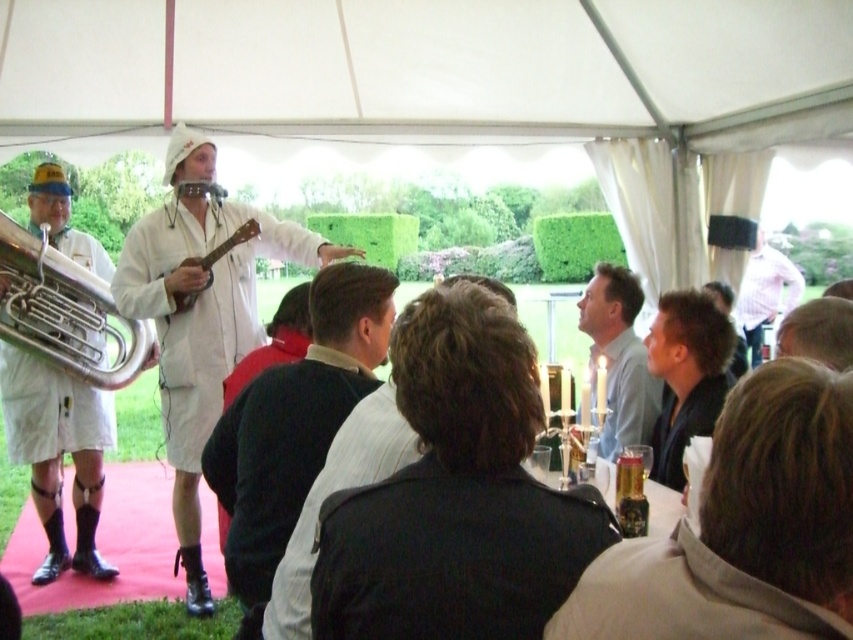
Can you confirm if dark brown leather jacket at center is wider than brass polished trumpet at left?

In fact, dark brown leather jacket at center might be narrower than brass polished trumpet at left.

Between dark brown leather jacket at center and brass polished trumpet at left, which one has less height?

Standing shorter between the two is brass polished trumpet at left.

I want to click on dark brown leather jacket at center, so click(x=294, y=426).

This screenshot has width=853, height=640. What are the coordinates of `dark brown leather jacket at center` in the screenshot? It's located at (294, 426).

Can you confirm if white matte coat at center is positioned to the right of light blue shirt at center?

Incorrect, white matte coat at center is not on the right side of light blue shirt at center.

Can you confirm if white matte coat at center is shorter than light blue shirt at center?

Incorrect, white matte coat at center's height does not fall short of light blue shirt at center's.

You are a GUI agent. You are given a task and a screenshot of the screen. Output one action in this format:
    pyautogui.click(x=<x>, y=<y>)
    Task: Click on the white matte coat at center
    The width and height of the screenshot is (853, 640).
    Given the screenshot: What is the action you would take?
    pyautogui.click(x=200, y=314)

Find the location of a particular element. The width and height of the screenshot is (853, 640). white matte coat at center is located at coordinates (200, 314).

Is the position of white matte coat at center less distant than that of brass polished trumpet at left?

Yes, it is in front of brass polished trumpet at left.

Can you confirm if white matte coat at center is positioned to the left of brass polished trumpet at left?

Incorrect, white matte coat at center is not on the left side of brass polished trumpet at left.

Does point (189, 500) come farther from viewer compared to point (80, 300)?

That is False.

The image size is (853, 640). In order to click on white matte coat at center in this screenshot , I will do `click(200, 314)`.